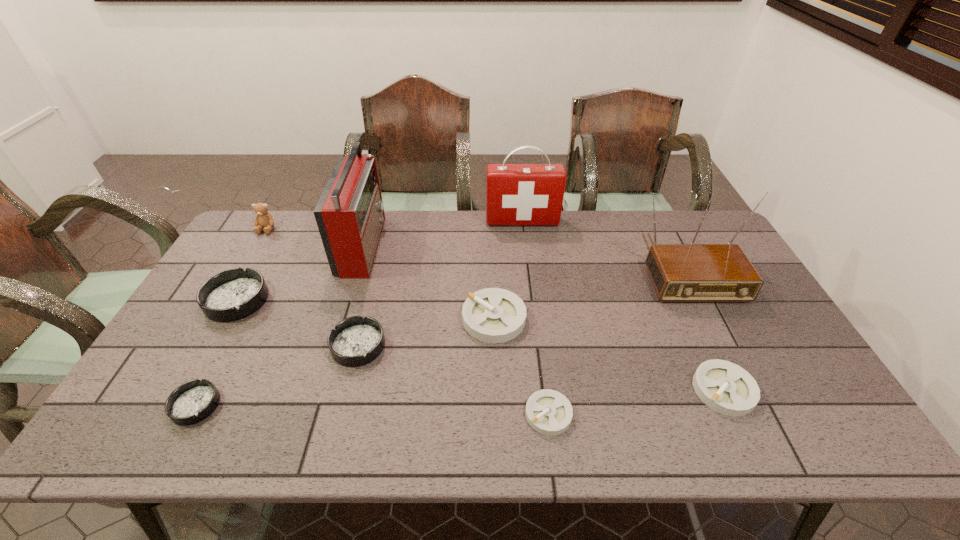
You are a GUI agent. You are given a task and a screenshot of the screen. Output one action in this format:
    pyautogui.click(x=<x>, y=<y>)
    Task: Click on the unoccupied position between the third ashtray from left to right and the left radio_receiver
    
    Given the screenshot: What is the action you would take?
    pyautogui.click(x=361, y=295)

The image size is (960, 540). Find the location of `free space between the rightmost dark ashtray and the smallest gray ashtray`. free space between the rightmost dark ashtray and the smallest gray ashtray is located at coordinates (453, 380).

The height and width of the screenshot is (540, 960). Identify the location of free space between the red first-aid kit and the right radio_receiver. (603, 244).

At what (x,y) coordinates should I click in order to perform the action: click on unoccupied area between the smallest dark ashtray and the right radio_receiver. Please return your answer as a coordinate pair (x, y). This screenshot has height=540, width=960. Looking at the image, I should click on (440, 336).

Find the location of a particular element. empty location between the smallest dark ashtray and the smallest gray ashtray is located at coordinates (372, 409).

This screenshot has height=540, width=960. Identify the location of the closest object to the left radio_receiver. (233, 294).

In order to click on the eighth closest object to the fourth ashtray from right to left in this screenshot , I will do `click(692, 272)`.

You are a GUI agent. You are given a task and a screenshot of the screen. Output one action in this format:
    pyautogui.click(x=<x>, y=<y>)
    Task: Click on the ashtray that is the third nearest to the teddy bear
    
    Given the screenshot: What is the action you would take?
    pyautogui.click(x=193, y=401)

Find the location of `ashtray that is the closest one to the nearest dark ashtray`. ashtray that is the closest one to the nearest dark ashtray is located at coordinates (233, 294).

Identify the location of dark ashtray object that ranks as the closest to the brown teddy bear. 233,294.